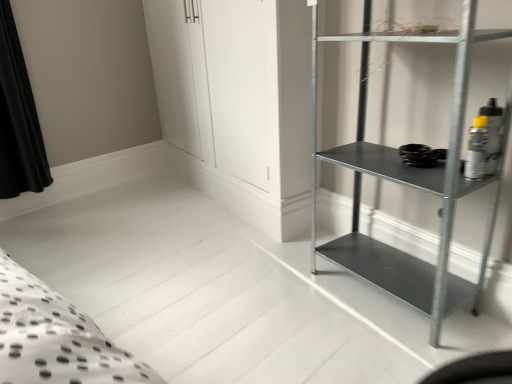
Question: Should I look upward or downward to see metallic gray shelf at right?

Choices:
 (A) down
 (B) up

Answer: (A)

Question: Considering the relative sizes of metallic gray shelf at right and metallic gray shelf at right in the image provided, is metallic gray shelf at right wider than metallic gray shelf at right?

Choices:
 (A) no
 (B) yes

Answer: (B)

Question: Are metallic gray shelf at right and metallic gray shelf at right located far from each other?

Choices:
 (A) no
 (B) yes

Answer: (A)

Question: Is the position of metallic gray shelf at right more distant than that of metallic gray shelf at right?

Choices:
 (A) yes
 (B) no

Answer: (B)

Question: Is metallic gray shelf at right looking in the opposite direction of metallic gray shelf at right?

Choices:
 (A) yes
 (B) no

Answer: (A)

Question: Is metallic gray shelf at right bigger than metallic gray shelf at right?

Choices:
 (A) yes
 (B) no

Answer: (A)

Question: Is metallic gray shelf at right located outside metallic gray shelf at right?

Choices:
 (A) no
 (B) yes

Answer: (B)

Question: Considering the relative sizes of metallic gray shelf at right and metallic gray shelf at right in the image provided, is metallic gray shelf at right shorter than metallic gray shelf at right?

Choices:
 (A) no
 (B) yes

Answer: (B)

Question: Does metallic gray shelf at right have a greater height compared to metallic gray shelf at right?

Choices:
 (A) no
 (B) yes

Answer: (A)

Question: Is the surface of metallic gray shelf at right in direct contact with metallic gray shelf at right?

Choices:
 (A) yes
 (B) no

Answer: (B)

Question: Is metallic gray shelf at right positioned behind metallic gray shelf at right?

Choices:
 (A) no
 (B) yes

Answer: (B)

Question: Does metallic gray shelf at right have a greater width compared to metallic gray shelf at right?

Choices:
 (A) yes
 (B) no

Answer: (B)

Question: Is metallic gray shelf at right positioned far away from metallic gray shelf at right?

Choices:
 (A) yes
 (B) no

Answer: (B)

Question: Choose the correct answer: Is metallic gray shelf at right inside metallic gray shelf at right or outside it?

Choices:
 (A) inside
 (B) outside

Answer: (B)